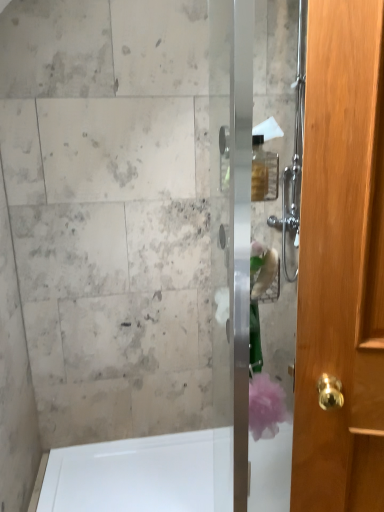
Question: Can you confirm if clear glass shower door at center is thinner than white glossy bathtub at lower left?

Choices:
 (A) yes
 (B) no

Answer: (A)

Question: Is clear glass shower door at center shorter than white glossy bathtub at lower left?

Choices:
 (A) yes
 (B) no

Answer: (B)

Question: Can you confirm if clear glass shower door at center is smaller than white glossy bathtub at lower left?

Choices:
 (A) no
 (B) yes

Answer: (B)

Question: Is clear glass shower door at center positioned before white glossy bathtub at lower left?

Choices:
 (A) no
 (B) yes

Answer: (B)

Question: Is clear glass shower door at center outside white glossy bathtub at lower left?

Choices:
 (A) no
 (B) yes

Answer: (B)

Question: From a real-world perspective, does clear glass shower door at center stand above white glossy bathtub at lower left?

Choices:
 (A) yes
 (B) no

Answer: (A)

Question: Would you say clear glass shower door at center is part of white glossy bathtub at lower left's contents?

Choices:
 (A) yes
 (B) no

Answer: (B)

Question: Does white glossy bathtub at lower left have a lesser width compared to clear glass shower door at center?

Choices:
 (A) no
 (B) yes

Answer: (A)

Question: Would you say white glossy bathtub at lower left is outside clear glass shower door at center?

Choices:
 (A) yes
 (B) no

Answer: (A)

Question: Does white glossy bathtub at lower left appear on the left side of clear glass shower door at center?

Choices:
 (A) yes
 (B) no

Answer: (A)

Question: Is white glossy bathtub at lower left positioned with its back to clear glass shower door at center?

Choices:
 (A) no
 (B) yes

Answer: (A)

Question: Can you confirm if white glossy bathtub at lower left is bigger than clear glass shower door at center?

Choices:
 (A) yes
 (B) no

Answer: (A)

Question: From a real-world perspective, is white glossy bathtub at lower left physically located above or below clear glass shower door at center?

Choices:
 (A) above
 (B) below

Answer: (B)